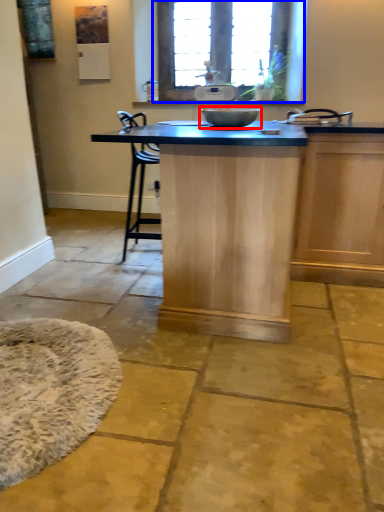
Question: Among these objects, which one is nearest to the camera, mixing bowl (highlighted by a red box) or window (highlighted by a blue box)?

Choices:
 (A) mixing bowl
 (B) window

Answer: (A)